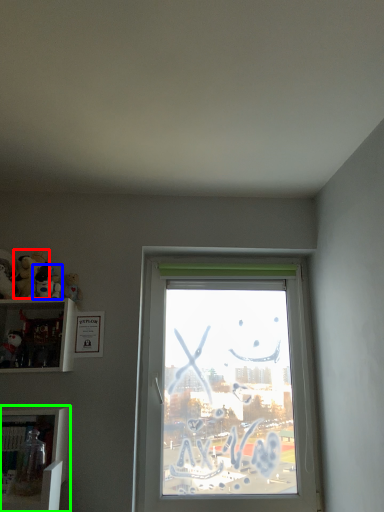
Question: Considering the real-world distances, which object is farthest from toy (highlighted by a red box)? toy (highlighted by a blue box) or shelf (highlighted by a green box)?

Choices:
 (A) toy
 (B) shelf

Answer: (B)